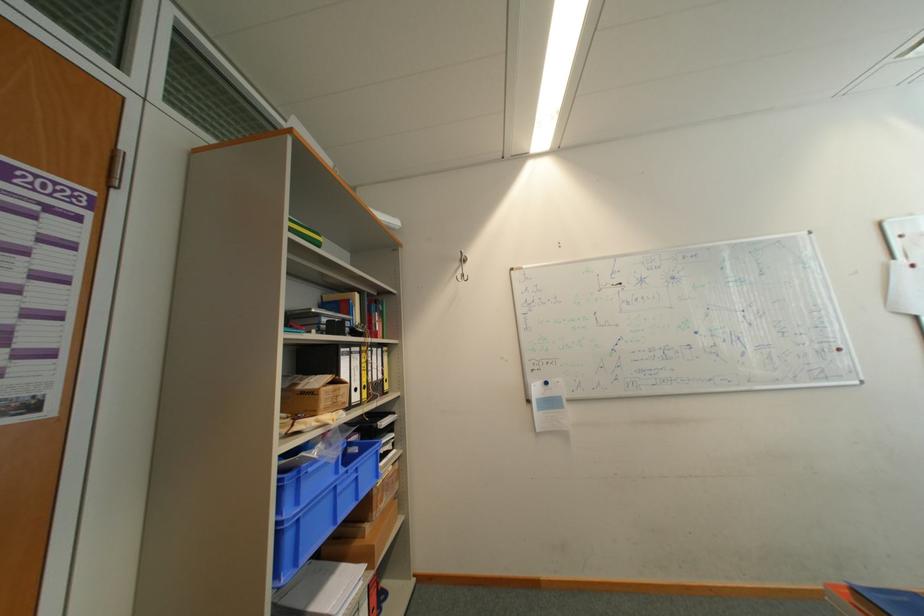
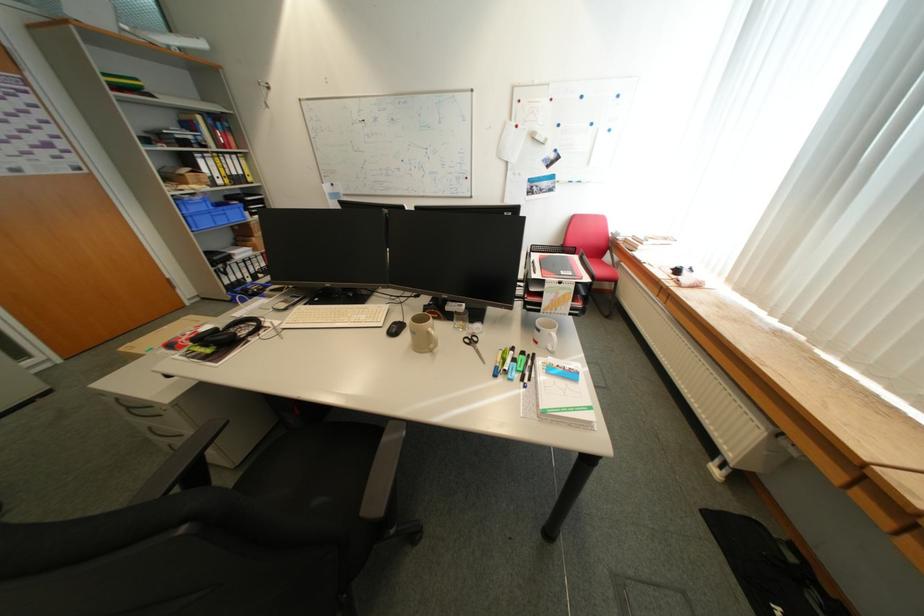
The point at (298, 538) is marked in the first image. Where is the corresponding point in the second image?

(199, 220)